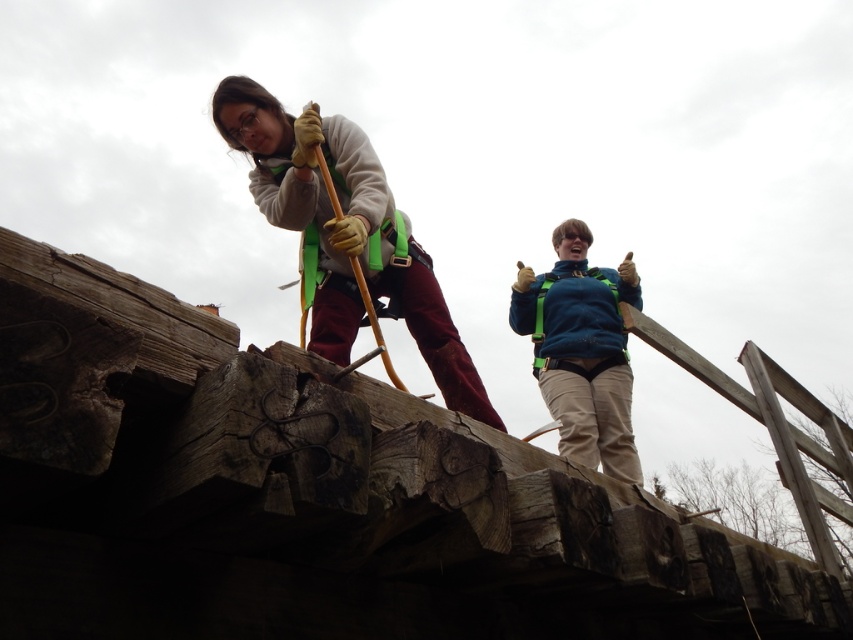
You are a safety inspector reviewing the image. The matte green safety harness at upper left and the teal fabric safety vest at upper center are both visible. According to safety protocols, which item should be worn over the other?

The matte green safety harness at upper left is positioned over the teal fabric safety vest at upper center, so it should be worn over the vest as per safety protocols.

You are a safety inspector assessing the setup of the harnesses on the wooden structure. The safety regulations state that all harnesses must be at least 10 feet away from the camera to ensure proper visibility and safety. Is the matte green safety harness at upper left compliant with this regulation?

The matte green safety harness at upper left is 9.20 feet away from the camera, which is less than the required 10 feet. Therefore, it does not comply with the safety regulation.